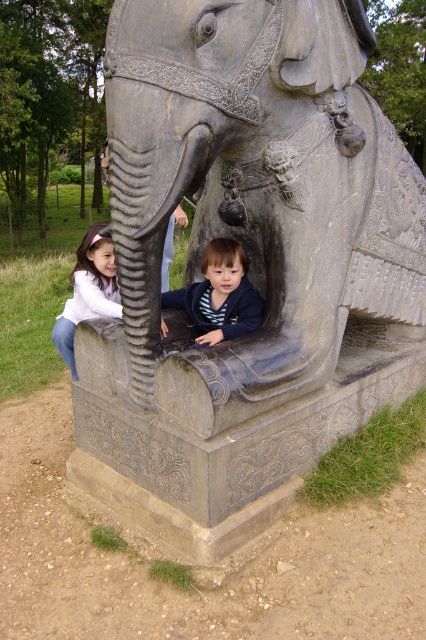
Is gray stone elephant at center thinner than dark blue fleece at lower center?

In fact, gray stone elephant at center might be wider than dark blue fleece at lower center.

Is gray stone elephant at center further to camera compared to dark blue fleece at lower center?

That is False.

Who is more forward, [235,26] or [233,289]?

Positioned in front is point [235,26].

This screenshot has width=426, height=640. Identify the location of gray stone elephant at center. (258, 188).

Between point (244, 333) and point (78, 248), which one is positioned behind?

The point (78, 248) is behind.

Who is lower down, dark blue fleece at lower center or matte white shirt at lower left?

matte white shirt at lower left

This screenshot has width=426, height=640. I want to click on dark blue fleece at lower center, so click(x=219, y=294).

Does gray stone elephant at center appear on the right side of matte white shirt at lower left?

Yes, gray stone elephant at center is to the right of matte white shirt at lower left.

Based on the photo, who is taller, gray stone elephant at center or matte white shirt at lower left?

gray stone elephant at center

I want to click on gray stone elephant at center, so click(258, 188).